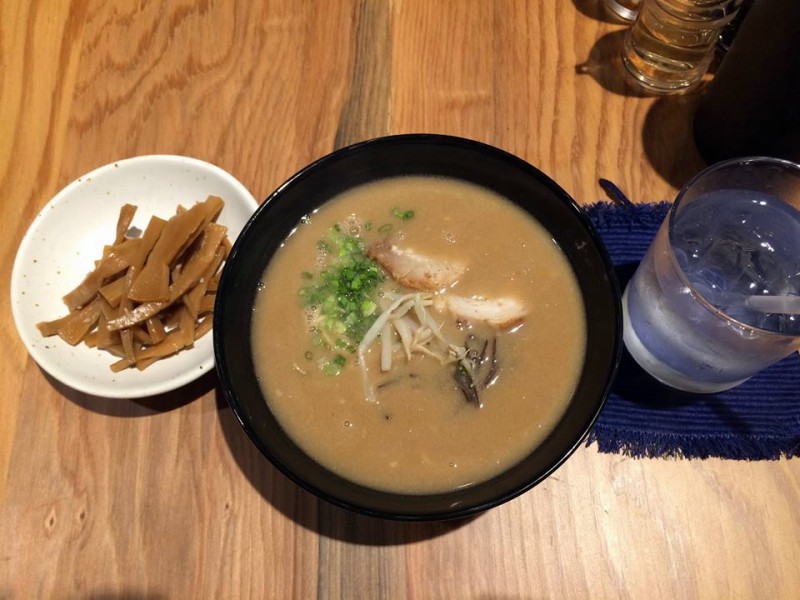
Image resolution: width=800 pixels, height=600 pixels. I want to click on cup, so click(x=714, y=292).